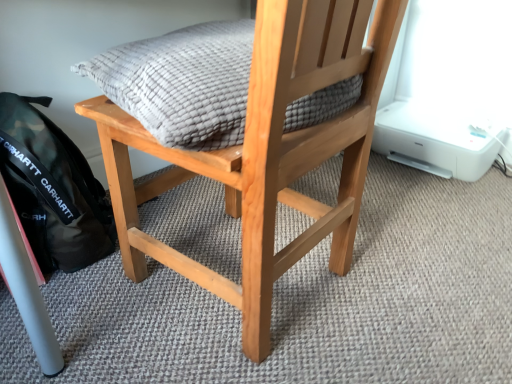
Question: Considering the relative positions of natural wood chair at center and textured gray cushion at center in the image provided, is natural wood chair at center behind textured gray cushion at center?

Choices:
 (A) no
 (B) yes

Answer: (A)

Question: From the image's perspective, is natural wood chair at center located above textured gray cushion at center?

Choices:
 (A) yes
 (B) no

Answer: (A)

Question: Is natural wood chair at center thinner than textured gray cushion at center?

Choices:
 (A) yes
 (B) no

Answer: (B)

Question: Is natural wood chair at center taller than textured gray cushion at center?

Choices:
 (A) no
 (B) yes

Answer: (B)

Question: From a real-world perspective, does natural wood chair at center stand above textured gray cushion at center?

Choices:
 (A) yes
 (B) no

Answer: (B)

Question: From a real-world perspective, is natural wood chair at center beneath textured gray cushion at center?

Choices:
 (A) no
 (B) yes

Answer: (B)

Question: Would you say black matte backpack at lower left is a long distance from textured gray cushion at center?

Choices:
 (A) yes
 (B) no

Answer: (B)

Question: Does black matte backpack at lower left turn towards textured gray cushion at center?

Choices:
 (A) yes
 (B) no

Answer: (B)

Question: Would you say textured gray cushion at center is part of black matte backpack at lower left's contents?

Choices:
 (A) yes
 (B) no

Answer: (B)

Question: Can you confirm if black matte backpack at lower left is shorter than textured gray cushion at center?

Choices:
 (A) no
 (B) yes

Answer: (A)

Question: Are black matte backpack at lower left and textured gray cushion at center making contact?

Choices:
 (A) no
 (B) yes

Answer: (A)

Question: From the image's perspective, is black matte backpack at lower left on top of textured gray cushion at center?

Choices:
 (A) no
 (B) yes

Answer: (A)

Question: Can you confirm if textured gray cushion at center is bigger than black matte backpack at lower left?

Choices:
 (A) no
 (B) yes

Answer: (B)